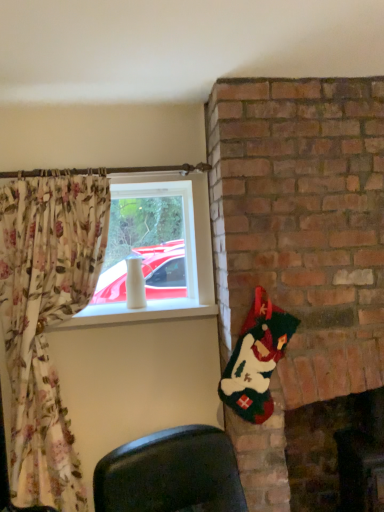
Question: In the image, is white glossy vase at upper left positioned in front of or behind brick fireplace at lower right?

Choices:
 (A) front
 (B) behind

Answer: (B)

Question: From the image's perspective, relative to brick fireplace at lower right, is white glossy vase at upper left above or below?

Choices:
 (A) above
 (B) below

Answer: (A)

Question: Is white glossy vase at upper left inside or outside of brick fireplace at lower right?

Choices:
 (A) inside
 (B) outside

Answer: (B)

Question: Considering the positions of brick fireplace at lower right and white glossy vase at upper left in the image, is brick fireplace at lower right bigger or smaller than white glossy vase at upper left?

Choices:
 (A) small
 (B) big

Answer: (B)

Question: In terms of height, does brick fireplace at lower right look taller or shorter compared to white glossy vase at upper left?

Choices:
 (A) short
 (B) tall

Answer: (B)

Question: From a real-world perspective, relative to white glossy vase at upper left, is brick fireplace at lower right vertically above or below?

Choices:
 (A) above
 (B) below

Answer: (B)

Question: Do you think brick fireplace at lower right is within white glossy vase at upper left, or outside of it?

Choices:
 (A) inside
 (B) outside

Answer: (B)